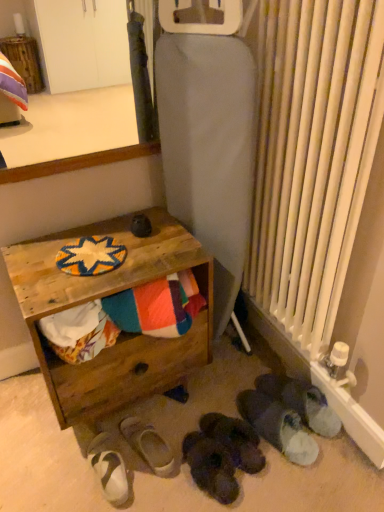
Locate an element on the screen. The height and width of the screenshot is (512, 384). vacant space situated above wooden crate at lower left (from a real-world perspective) is located at coordinates (92, 253).